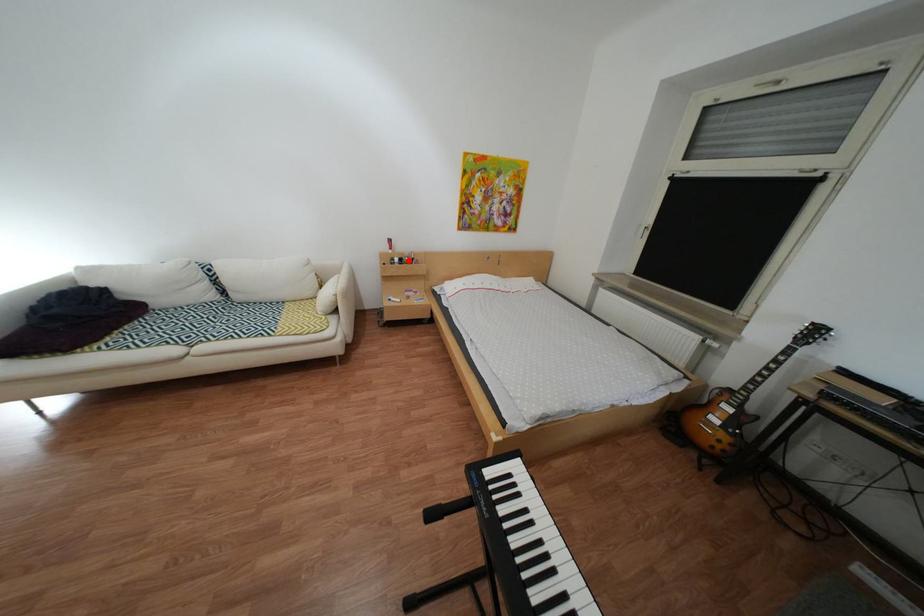
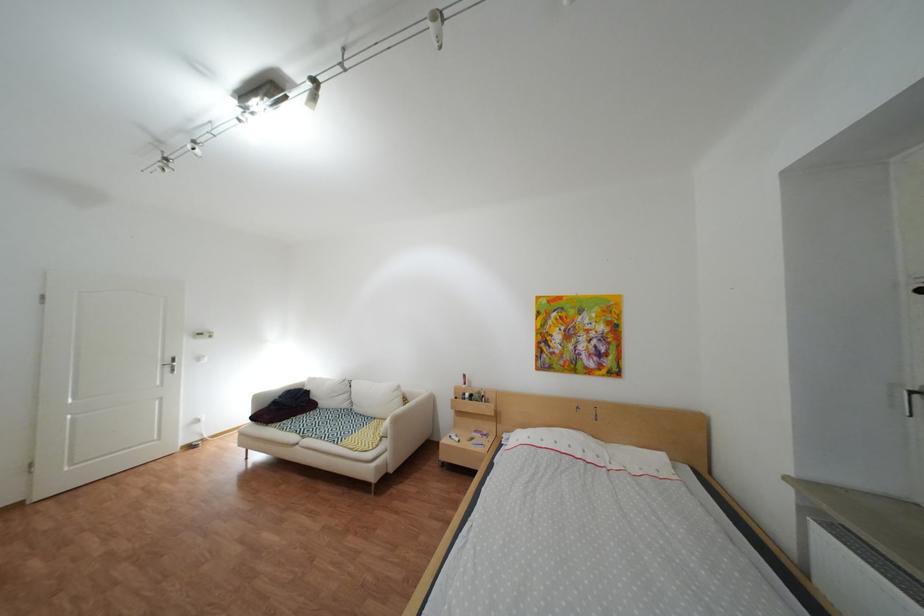
The point at the highlighted location is marked in the first image. Where is the corresponding point in the second image?

(480, 395)